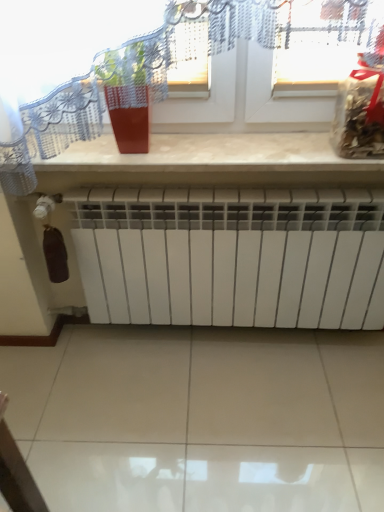
Image resolution: width=384 pixels, height=512 pixels. What are the coordinates of `free point to the right of matte red pot at upper center` in the screenshot? It's located at (190, 151).